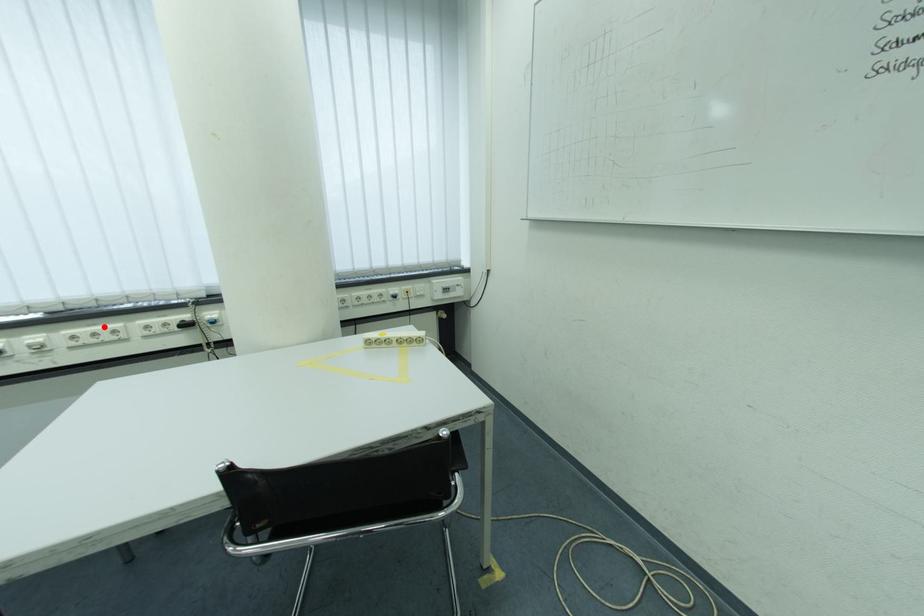
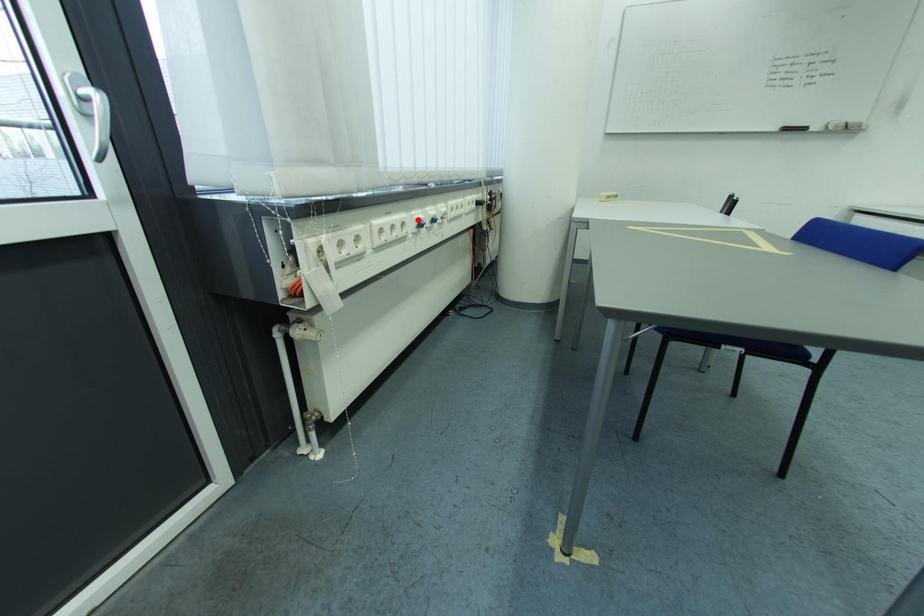
I am providing you with two images of the same scene from different viewpoints. A red point is marked on the first image and another point is marked on the second image. Are the points marked in image1 and image2 representing the same 3D position?

No